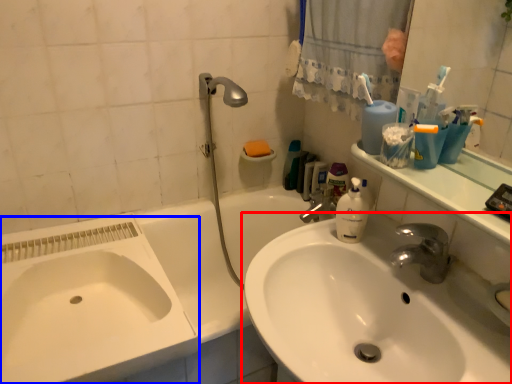
Question: Which of the following is the farthest to the observer, sink (highlighted by a red box) or sink (highlighted by a blue box)?

Choices:
 (A) sink
 (B) sink

Answer: (B)